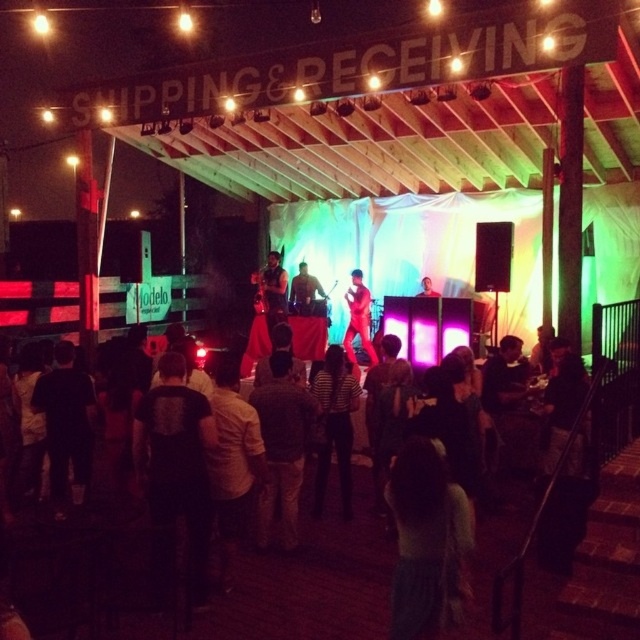
Between light green sweater at lower center and striped shirt at center, which one has more height?

With more height is striped shirt at center.

Is point (406, 460) farther from viewer compared to point (324, 392)?

That is False.

Between point (404, 618) and point (316, 378), which one is positioned behind?

The point (316, 378) is behind.

Identify the location of light green sweater at lower center. (424, 538).

Is light green sweater at lower center smaller than shiny red jacket at center?

Indeed, light green sweater at lower center has a smaller size compared to shiny red jacket at center.

Who is more forward, (435, 458) or (369, 292)?

Positioned in front is point (435, 458).

Consider the image. Who is more distant from viewer, (392, 616) or (364, 349)?

Positioned behind is point (364, 349).

Identify the location of light green sweater at lower center. (424, 538).

Based on the photo, who is taller, light green sweater at lower center or shiny black guitar at center?

With more height is shiny black guitar at center.

Can you confirm if light green sweater at lower center is positioned to the left of shiny black guitar at center?

Incorrect, light green sweater at lower center is not on the left side of shiny black guitar at center.

In order to click on light green sweater at lower center in this screenshot , I will do `click(424, 538)`.